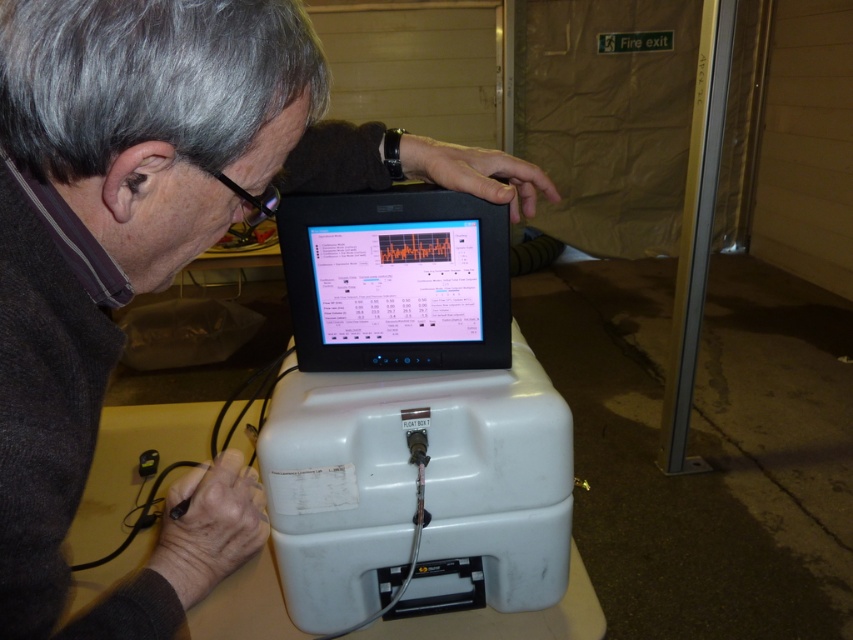
Question: Which point is farther from the camera taking this photo?

Choices:
 (A) (169, 92)
 (B) (380, 228)

Answer: (B)

Question: Which of the following is the closest to the observer?

Choices:
 (A) (305, 218)
 (B) (267, 195)

Answer: (B)

Question: In this image, where is matte black monitor at center located relative to black glossy tablet at center?

Choices:
 (A) left
 (B) right

Answer: (A)

Question: Observing the image, what is the correct spatial positioning of matte black monitor at center in reference to black glossy tablet at center?

Choices:
 (A) below
 (B) above

Answer: (B)

Question: Is matte black monitor at center above black glossy tablet at center?

Choices:
 (A) yes
 (B) no

Answer: (A)

Question: Which point is closer to the camera?

Choices:
 (A) (189, 588)
 (B) (311, 307)

Answer: (A)